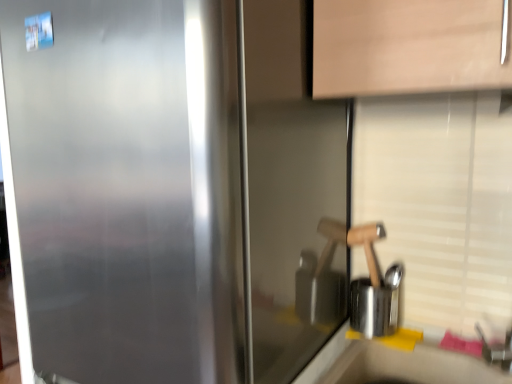
Question: Can you confirm if satin metallic refrigerator at center is thinner than smooth white countertop at lower right?

Choices:
 (A) no
 (B) yes

Answer: (A)

Question: Can you confirm if satin metallic refrigerator at center is shorter than smooth white countertop at lower right?

Choices:
 (A) no
 (B) yes

Answer: (A)

Question: Is satin metallic refrigerator at center aimed at smooth white countertop at lower right?

Choices:
 (A) no
 (B) yes

Answer: (A)

Question: From the image's perspective, is satin metallic refrigerator at center over smooth white countertop at lower right?

Choices:
 (A) yes
 (B) no

Answer: (A)

Question: Can you confirm if satin metallic refrigerator at center is wider than smooth white countertop at lower right?

Choices:
 (A) yes
 (B) no

Answer: (A)

Question: Considering the relative positions of smooth white countertop at lower right and satin metallic refrigerator at center in the image provided, is smooth white countertop at lower right to the left or to the right of satin metallic refrigerator at center?

Choices:
 (A) right
 (B) left

Answer: (A)

Question: Choose the correct answer: Is smooth white countertop at lower right inside satin metallic refrigerator at center or outside it?

Choices:
 (A) outside
 (B) inside

Answer: (A)

Question: From a real-world perspective, is smooth white countertop at lower right physically located above or below satin metallic refrigerator at center?

Choices:
 (A) below
 (B) above

Answer: (A)

Question: Considering the positions of point (329, 377) and point (88, 26), is point (329, 377) closer or farther from the camera than point (88, 26)?

Choices:
 (A) farther
 (B) closer

Answer: (A)

Question: Is wooden handle at right spatially inside smooth white countertop at lower right, or outside of it?

Choices:
 (A) outside
 (B) inside

Answer: (A)

Question: Is wooden handle at right in front of or behind smooth white countertop at lower right in the image?

Choices:
 (A) front
 (B) behind

Answer: (B)

Question: Does point (371, 273) appear closer or farther from the camera than point (392, 362)?

Choices:
 (A) closer
 (B) farther

Answer: (B)

Question: Is wooden handle at right taller or shorter than smooth white countertop at lower right?

Choices:
 (A) tall
 (B) short

Answer: (B)

Question: In the image, is satin metallic refrigerator at center positioned in front of or behind wooden handle at right?

Choices:
 (A) front
 (B) behind

Answer: (A)

Question: Does point (289, 201) appear closer or farther from the camera than point (324, 248)?

Choices:
 (A) closer
 (B) farther

Answer: (A)